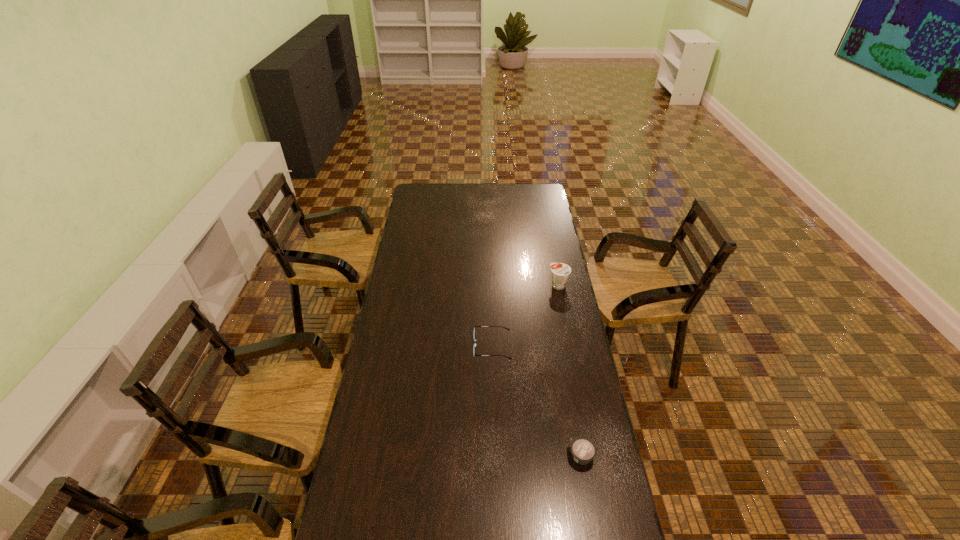
This screenshot has height=540, width=960. In order to click on the taller yogurt in this screenshot , I will do `click(560, 272)`.

Find the location of `the farthest object`. the farthest object is located at coordinates (560, 272).

This screenshot has width=960, height=540. I want to click on the second farthest object, so click(x=475, y=326).

Identify the location of spectacles. (475, 326).

Find the location of `the nearest object`. the nearest object is located at coordinates (583, 450).

Identify the location of the shorter yogurt. The width and height of the screenshot is (960, 540). (583, 450).

Find the location of `vacant space located 0.070m on the front of the taller yogurt`. vacant space located 0.070m on the front of the taller yogurt is located at coordinates (563, 303).

Where is `vacant region located on the lenses of the second farthest object`? vacant region located on the lenses of the second farthest object is located at coordinates (456, 346).

Where is `blank area located 0.050m on the lenses of the second farthest object`? blank area located 0.050m on the lenses of the second farthest object is located at coordinates (461, 346).

Identify the location of vacant position located 0.160m on the lenses of the second farthest object. (434, 346).